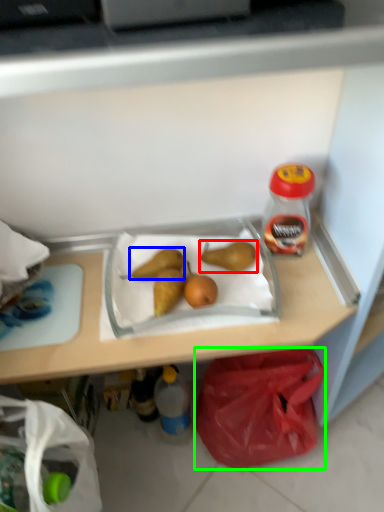
Question: Which is farther away from pear (highlighted by a red box)? pear (highlighted by a blue box) or plastic bag (highlighted by a green box)?

Choices:
 (A) pear
 (B) plastic bag

Answer: (B)